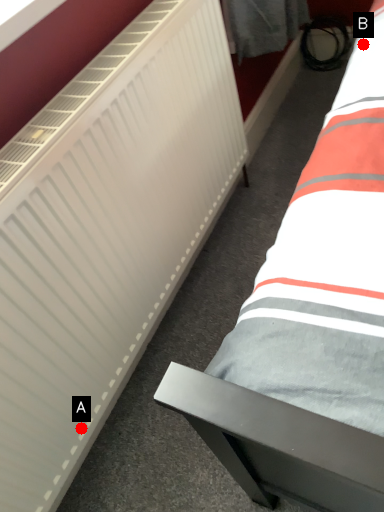
Question: Two points are circled on the image, labeled by A and B beside each circle. Which point is closer to the camera taking this photo?

Choices:
 (A) A is closer
 (B) B is closer

Answer: (A)